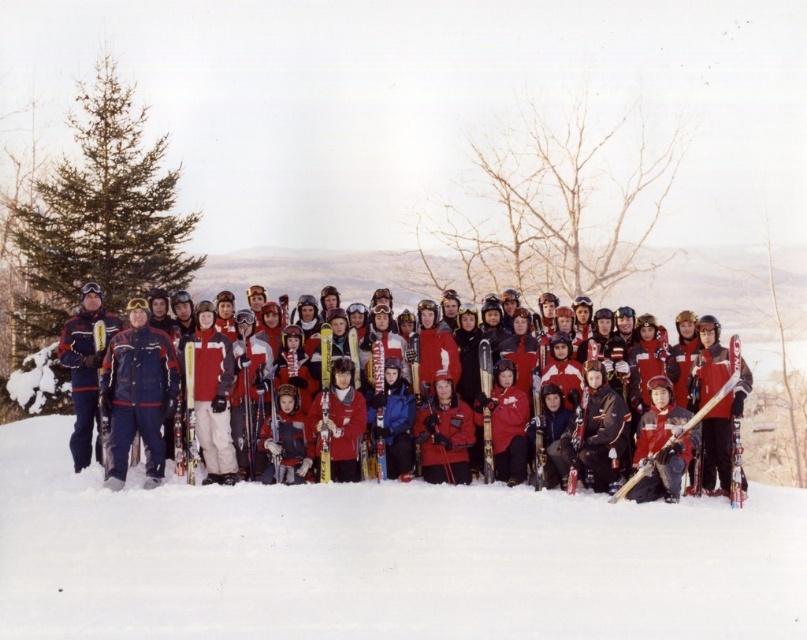
You are a photographer trying to capture a photo of the matte red jacket at center and the matte red skis at center. Since they are both red, you want to ensure you can distinguish them in the photo. Based on their positions, which object is located to the right of the other?

The matte red skis at center is positioned on the right side of matte red jacket at center, so the skis are to the right of the jacket.

You are a photographer trying to capture a clear shot of the matte red skis at center and the matte red jacket at center. Based on their sizes, which object would appear smaller in your photo?

The matte red skis at center would appear smaller in the photo because they have a smaller size compared to the matte red jacket at center.